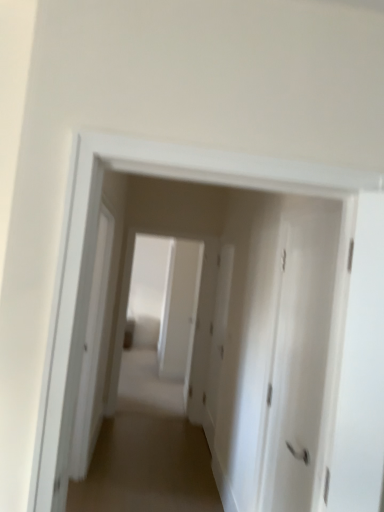
Question: Choose the correct answer: Is brown carpet at center inside white matte door at center, placed as the first door when sorted from back to front, or outside it?

Choices:
 (A) outside
 (B) inside

Answer: (A)

Question: Is brown carpet at center taller or shorter than white matte door at center, placed as the first door when sorted from back to front?

Choices:
 (A) tall
 (B) short

Answer: (B)

Question: Which object is the closest to the brown carpet at center?

Choices:
 (A) white matte door at center, which is the 2th door in back-to-front order
 (B) white matte door at center, the second door when ordered from front to back

Answer: (B)

Question: Which object is the farthest from the brown carpet at center?

Choices:
 (A) white matte door at center, placed as the first door when sorted from front to back
 (B) white matte door at center, placed as the first door when sorted from back to front

Answer: (A)